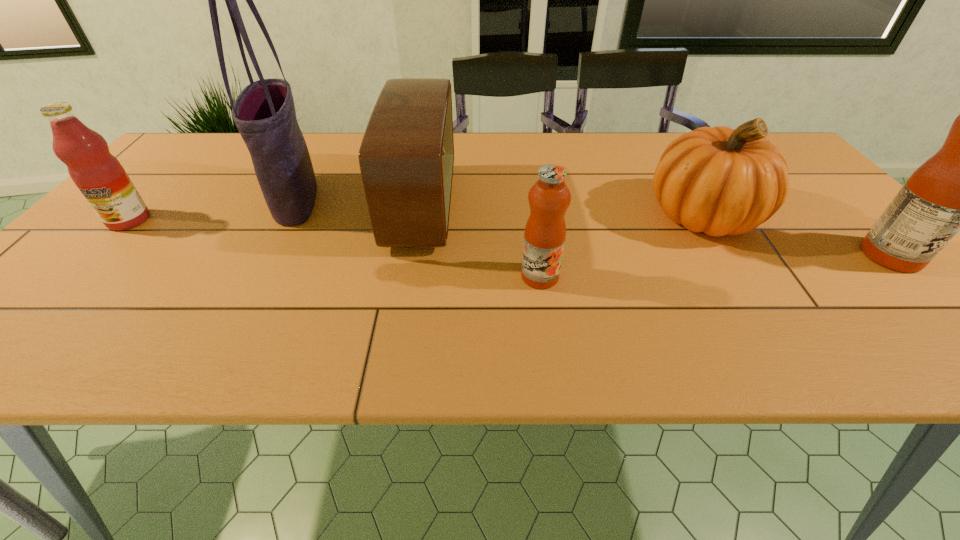
Please point out where to position a new fruit juice on the left to maintain spacing. Please provide its 2D coordinates. Your answer should be formatted as a tuple, i.e. [(x, y)], where the tuple contains the x and y coordinates of a point satisfying the conditions above.

[(151, 300)]